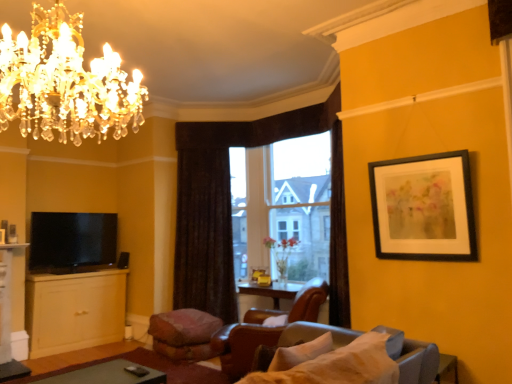
Question: Is point (74, 296) positioned closer to the camera than point (111, 263)?

Choices:
 (A) farther
 (B) closer

Answer: (B)

Question: Would you say matte yellow cabinet at lower left is inside or outside matte black tv at lower left?

Choices:
 (A) inside
 (B) outside

Answer: (B)

Question: Estimate the real-world distances between objects in this image. Which object is farther from the matte yellow cabinet at lower left?

Choices:
 (A) transparent glass window at center
 (B) green matte table at lower left
 (C) matte black tv at lower left
 (D) crystal gold chandelier at upper left
 (E) pink fabric footrest at lower center

Answer: (D)

Question: Estimate the real-world distances between objects in this image. Which object is farther from the pink fabric footrest at lower center?

Choices:
 (A) transparent glass window at center
 (B) matte yellow cabinet at lower left
 (C) matte black tv at lower left
 (D) dark brown textured curtain at center
 (E) leather at center

Answer: (C)